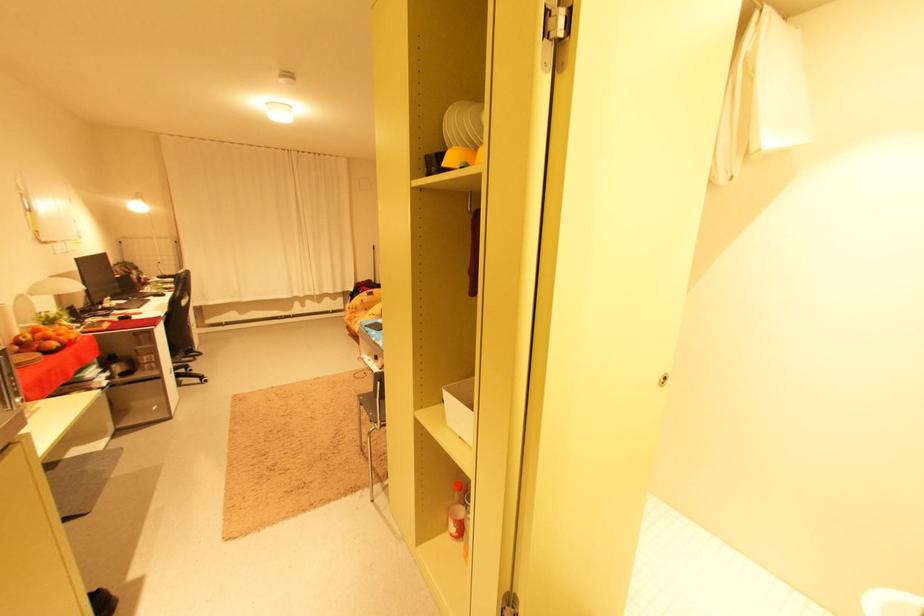
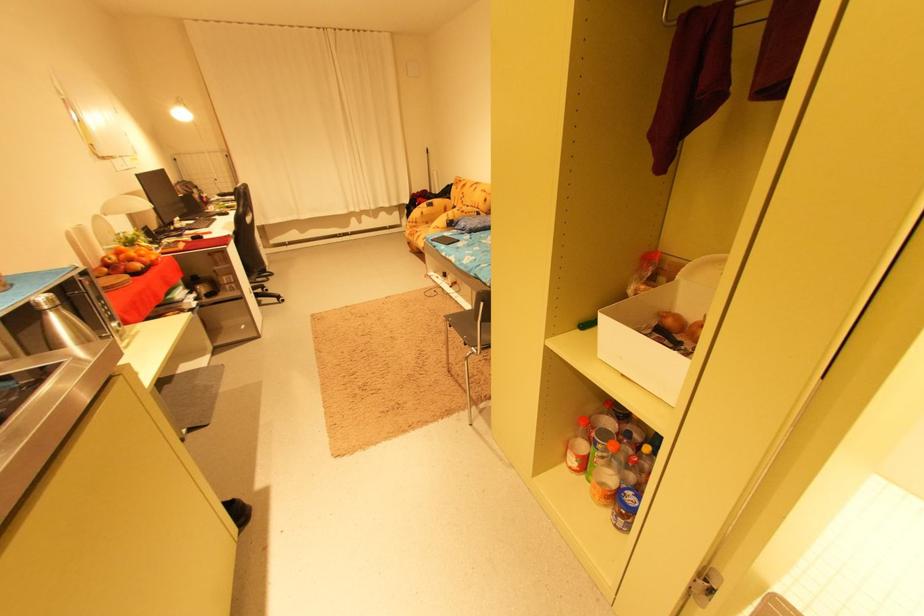
Question: I am providing you with two images of the same scene from different viewpoints. Given a red point in image1, look at the same physical point in image2. Is it:

Choices:
 (A) Closer to the viewpoint
 (B) Farther from the viewpoint

Answer: (A)